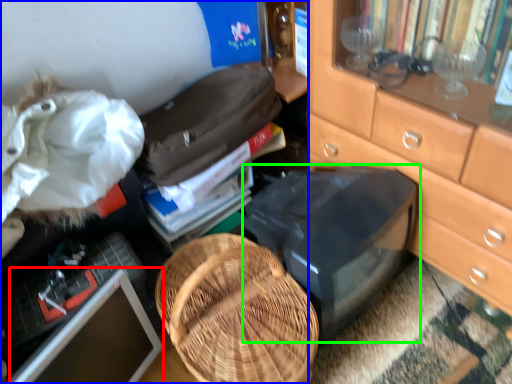
Question: Which object is positioned farthest from computer monitor (highlighted by a red box)? Select from desk (highlighted by a blue box) and desktop (highlighted by a green box).

Choices:
 (A) desk
 (B) desktop

Answer: (B)